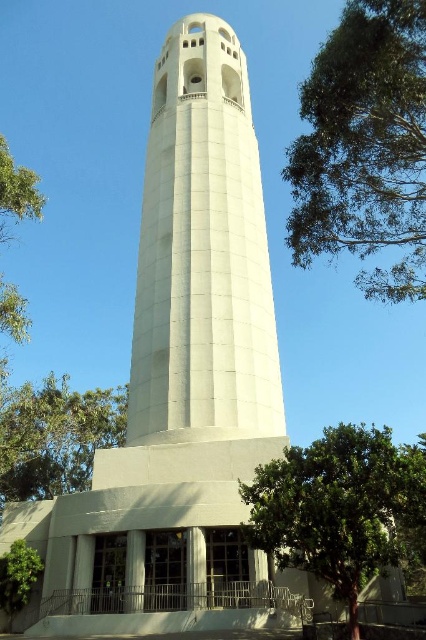
You are a visitor standing at the entrance of the white concrete tower at center. You notice a green leafy tree at lower left in the distance. Which object appears closer to you from your current position?

The green leafy tree at lower left appears closer to you than the white concrete tower at center because the white concrete tower at center has a smaller size compared to green leafy tree at lower left, indicating it is farther away.

You are standing in front of the white concrete tower at center and the green leafy tree at left. Which object is taller?

The white concrete tower at center is taller than the green leafy tree at left.